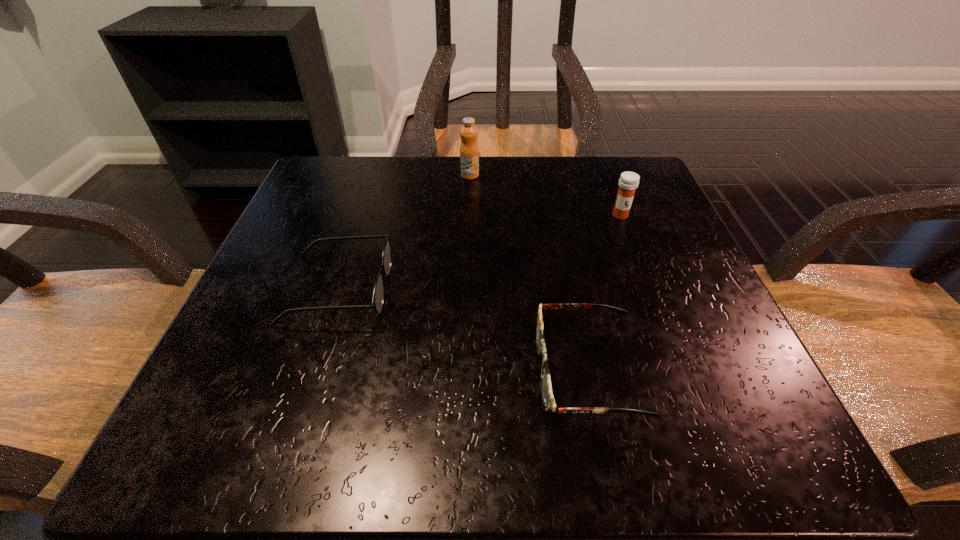
Identify the location of unoccupied position between the second farthest object and the second object from left to right. The width and height of the screenshot is (960, 540). (545, 195).

At what (x,y) coordinates should I click in order to perform the action: click on empty space between the right spectacles and the third shortest object. Please return your answer as a coordinate pair (x, y). The width and height of the screenshot is (960, 540). Looking at the image, I should click on (604, 293).

What are the coordinates of `free area in between the third nearest object and the right spectacles` in the screenshot? It's located at (604, 293).

The height and width of the screenshot is (540, 960). In order to click on free space that is in between the third object from left to right and the left spectacles in this screenshot , I will do `click(463, 330)`.

The image size is (960, 540). What are the coordinates of `vacant region between the farthest object and the leftmost object` in the screenshot? It's located at (404, 232).

Where is `the closest object to the second object from right to left`? The width and height of the screenshot is (960, 540). the closest object to the second object from right to left is located at coordinates (378, 295).

Choose which object is the third nearest neighbor to the rightmost object. Please provide its 2D coordinates. Your answer should be formatted as a tuple, i.e. [(x, y)], where the tuple contains the x and y coordinates of a point satisfying the conditions above.

[(378, 295)]

I want to click on free space that satisfies the following two spatial constraints: 1. on the label side of the third shortest object; 2. on the front-facing side of the left spectacles, so click(649, 289).

At what (x,y) coordinates should I click in order to perform the action: click on blank area in the image that satisfies the following two spatial constraints: 1. on the label side of the rightmost object; 2. on the frame of the right spectacles. Please return your answer as a coordinate pair (x, y). Image resolution: width=960 pixels, height=540 pixels. Looking at the image, I should click on (681, 371).

At what (x,y) coordinates should I click in order to perform the action: click on free location that satisfies the following two spatial constraints: 1. on the label side of the rightmost object; 2. on the front-facing side of the left spectacles. Please return your answer as a coordinate pair (x, y). This screenshot has width=960, height=540. Looking at the image, I should click on pyautogui.click(x=649, y=289).